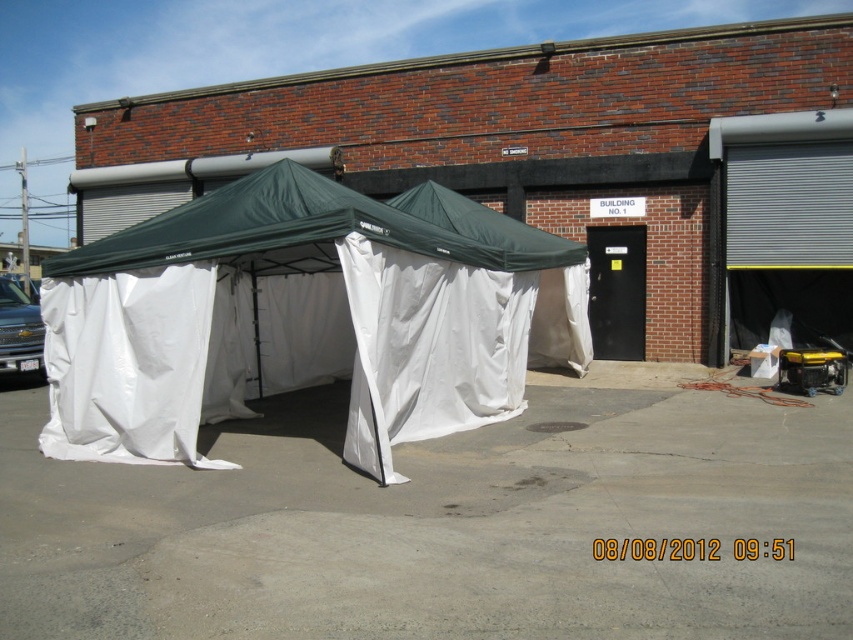
Question: Does black metal/glass door at center appear under gray metallic garage door at right?

Choices:
 (A) yes
 (B) no

Answer: (A)

Question: Estimate the real-world distances between objects in this image. Which object is farther from the green fabric tent at center?

Choices:
 (A) gray metallic garage door at right
 (B) black metal/glass door at center

Answer: (A)

Question: In this image, where is green fabric tent at center located relative to black metal/glass door at center?

Choices:
 (A) above
 (B) below

Answer: (B)

Question: Which point appears farthest from the camera in this image?

Choices:
 (A) (165, 337)
 (B) (599, 243)

Answer: (B)

Question: Which object is closer to the camera taking this photo?

Choices:
 (A) black metal/glass door at center
 (B) gray metallic garage door at right

Answer: (B)

Question: Can you confirm if green fabric tent at center is positioned to the left of gray metallic garage door at right?

Choices:
 (A) no
 (B) yes

Answer: (B)